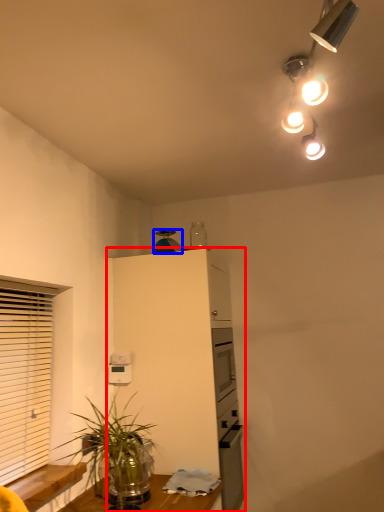
Question: Which object is further to the camera taking this photo, cabinetry (highlighted by a red box) or appliance (highlighted by a blue box)?

Choices:
 (A) cabinetry
 (B) appliance

Answer: (B)